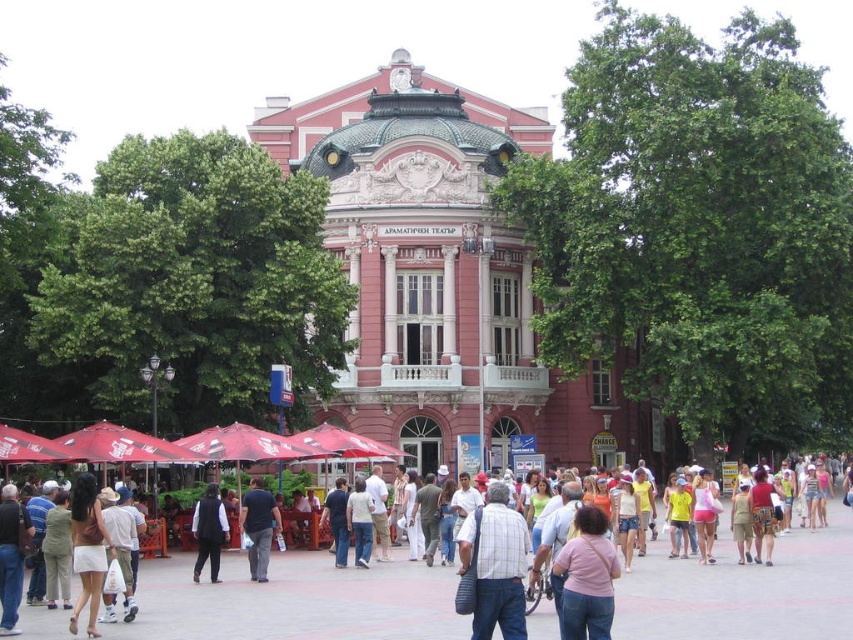
Question: Which point appears closest to the camera in this image?

Choices:
 (A) (212, 497)
 (B) (250, 557)

Answer: (B)

Question: Which object is positioned closest to the black leather vest at center?

Choices:
 (A) dark blue shirt at center
 (B) plaid shirt at center

Answer: (A)

Question: Can you confirm if pink fabric dress at center is wider than dark blue shirt at center?

Choices:
 (A) no
 (B) yes

Answer: (B)

Question: Can you confirm if pink fabric shirt at center is positioned to the right of dark blue shirt at center?

Choices:
 (A) no
 (B) yes

Answer: (B)

Question: Considering the relative positions of pink fabric shirt at center and black leather vest at center in the image provided, where is pink fabric shirt at center located with respect to black leather vest at center?

Choices:
 (A) left
 (B) right

Answer: (B)

Question: Which point is closer to the camera?

Choices:
 (A) (94, 604)
 (B) (259, 545)

Answer: (A)